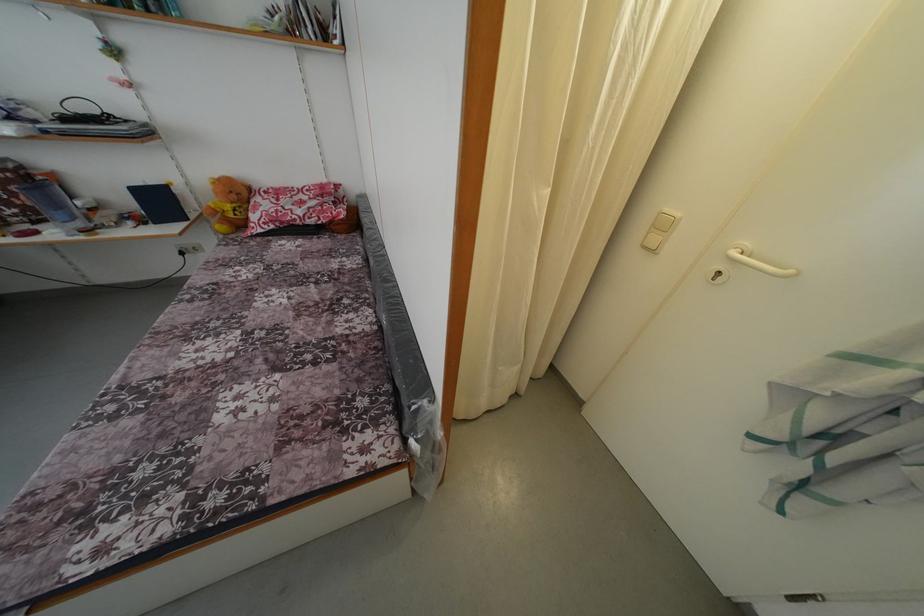
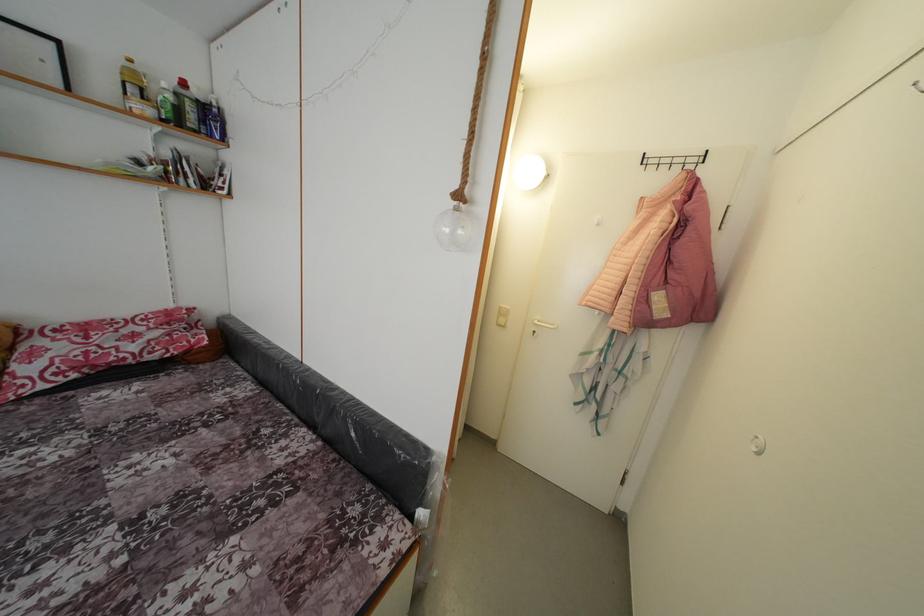
Question: The images are taken continuously from a first-person perspective. In which direction is your viewpoint rotating?

Choices:
 (A) Left
 (B) Right
 (C) Up
 (D) Down

Answer: (B)